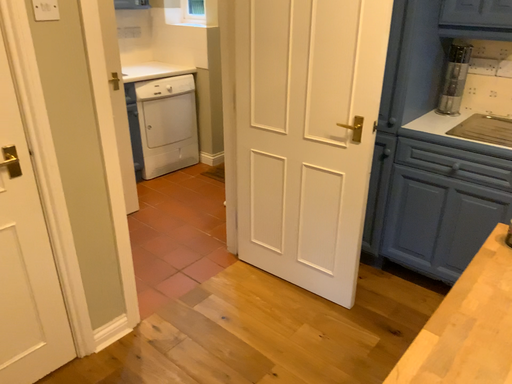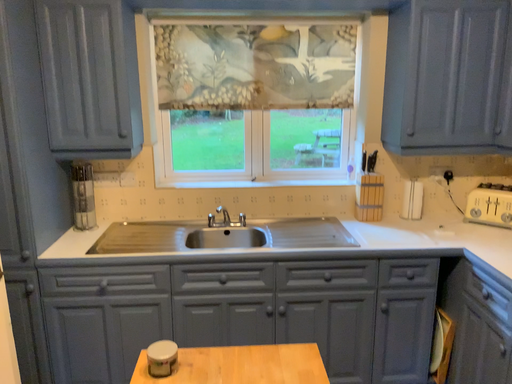
Question: Which way did the camera rotate in the video?

Choices:
 (A) rotated downward
 (B) rotated upward

Answer: (B)